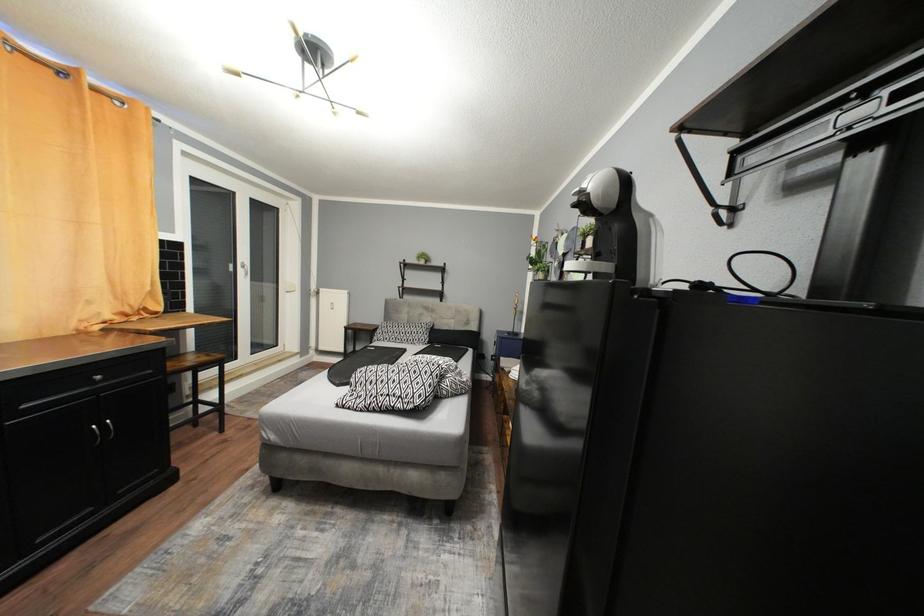
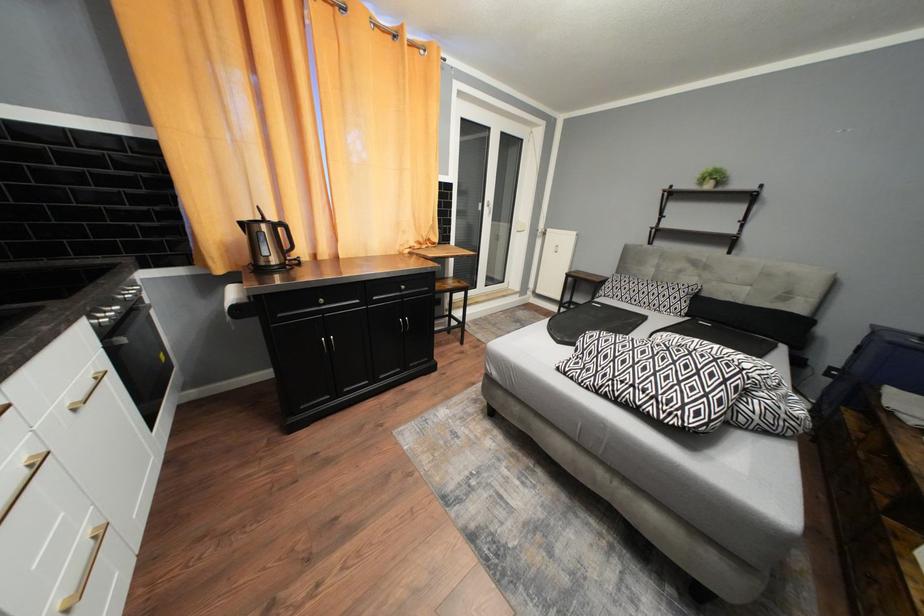
Question: The images are taken continuously from a first-person perspective. In which direction is your viewpoint rotating?

Choices:
 (A) Left
 (B) Right
 (C) Up
 (D) Down

Answer: (A)